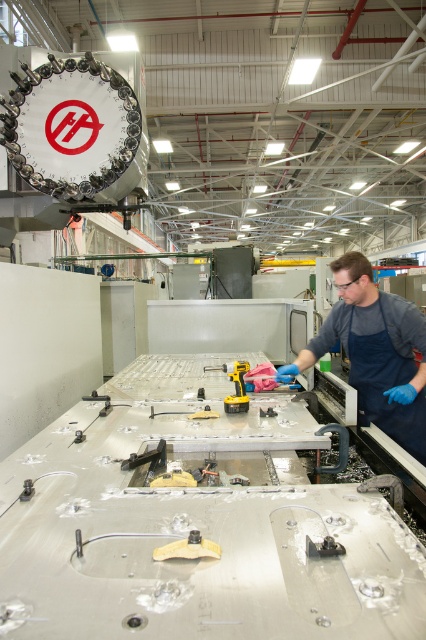
Question: Considering the real-world distances, which object is farthest from the blue rubber gloves at right?

Choices:
 (A) dark blue fabric apron at right
 (B) yellow plastic drill at center
 (C) yellow plastic tool at center

Answer: (C)

Question: Does yellow plastic tool at center appear under yellow plastic drill at center?

Choices:
 (A) no
 (B) yes

Answer: (B)

Question: Which object is the farthest from the metallic gray tool at center?

Choices:
 (A) yellow plastic drill at center
 (B) blue rubber gloves at right
 (C) dark blue fabric apron at right
 (D) yellow plastic tool at center

Answer: (C)

Question: Is yellow plastic drill at center bigger than metallic gray tool at center?

Choices:
 (A) no
 (B) yes

Answer: (B)

Question: Which point appears closest to the camera in this image?

Choices:
 (A) (356, 358)
 (B) (238, 387)
 (C) (183, 412)
 (D) (423, 324)

Answer: (C)

Question: In this image, where is dark blue fabric apron at right located relative to metallic gray tool at center?

Choices:
 (A) above
 (B) below

Answer: (A)